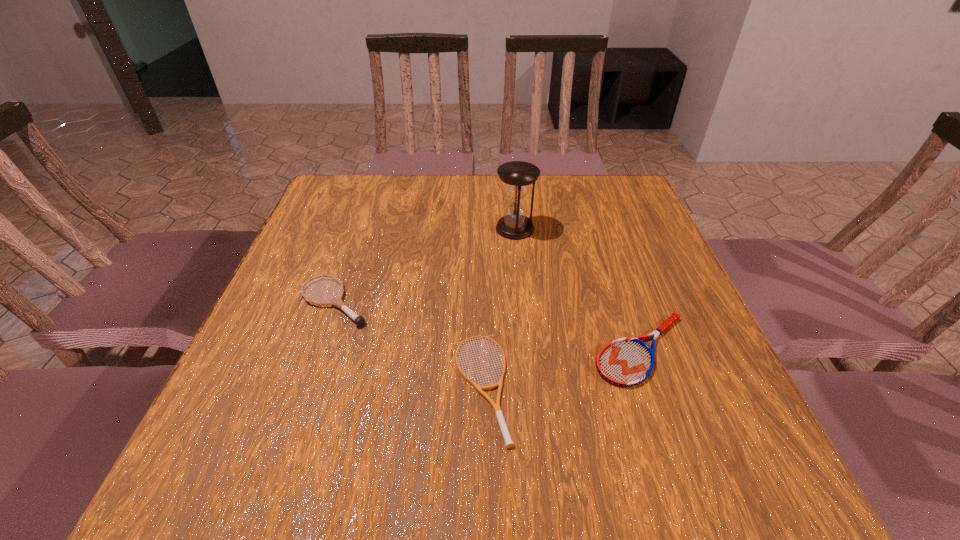
You are a GUI agent. You are given a task and a screenshot of the screen. Output one action in this format:
    pyautogui.click(x=<x>, y=<y>)
    Task: Click on the object located at the far edge
    
    Given the screenshot: What is the action you would take?
    pyautogui.click(x=518, y=176)

Locate an element on the screen. The width and height of the screenshot is (960, 540). object that is at the near edge is located at coordinates (496, 407).

Where is `object that is at the left edge`? object that is at the left edge is located at coordinates (337, 301).

The image size is (960, 540). I want to click on object present at the right edge, so 625,362.

You are a GUI agent. You are given a task and a screenshot of the screen. Output one action in this format:
    pyautogui.click(x=<x>, y=<y>)
    Task: Click on the vacant space at the far edge of the desktop
    The image size is (960, 540).
    Given the screenshot: What is the action you would take?
    pyautogui.click(x=412, y=218)

What are the coordinates of `free space at the near edge` in the screenshot? It's located at (540, 489).

You are a GUI agent. You are given a task and a screenshot of the screen. Output one action in this format:
    pyautogui.click(x=<x>, y=<y>)
    Task: Click on the free space at the left edge
    The image size is (960, 540).
    Given the screenshot: What is the action you would take?
    pyautogui.click(x=225, y=428)

The width and height of the screenshot is (960, 540). Find the location of `vacant space at the right edge of the desktop`. vacant space at the right edge of the desktop is located at coordinates (630, 242).

Locate an element on the screen. The width and height of the screenshot is (960, 540). blank area at the near left corner is located at coordinates (195, 488).

The width and height of the screenshot is (960, 540). I want to click on vacant space at the near right corner, so click(687, 449).